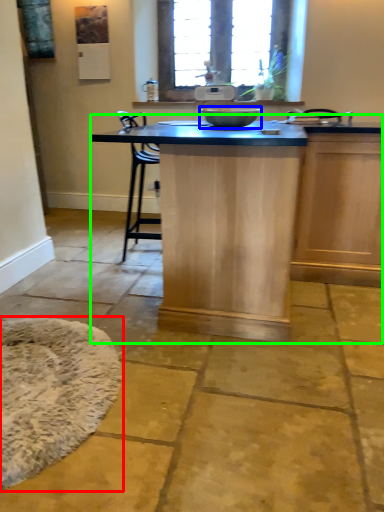
Question: Considering the real-world distances, which object is closest to mat (highlighted by a red box)? mixing bowl (highlighted by a blue box) or table (highlighted by a green box).

Choices:
 (A) mixing bowl
 (B) table

Answer: (B)